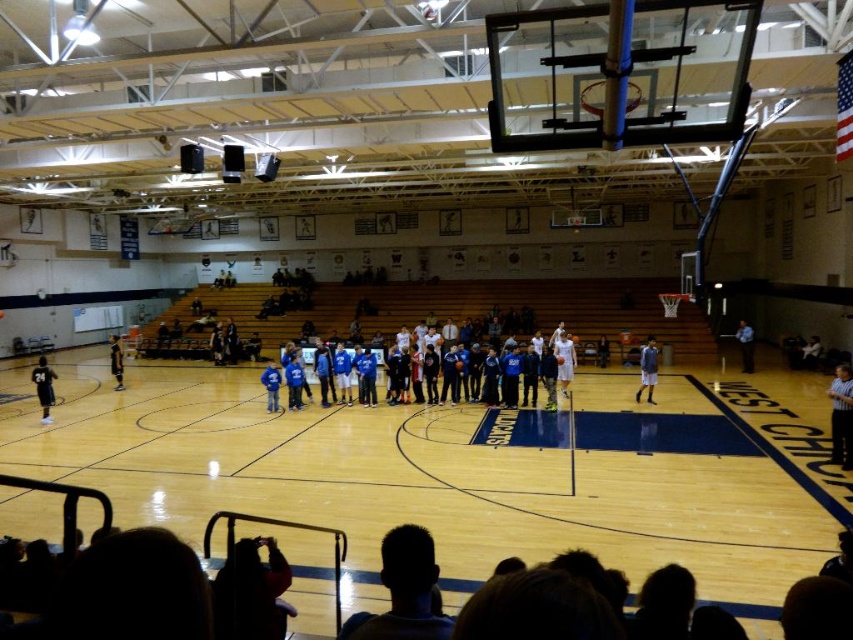
Looking at this image, is gray fabric jacket at lower right smaller than blue shirt at center?

Yes.

Is point (653, 371) positioned before point (741, 340)?

Yes, it is.

Is point (647, 348) in front of point (751, 365)?

That is True.

Image resolution: width=853 pixels, height=640 pixels. I want to click on gray fabric jacket at lower right, so click(x=647, y=369).

Is white matte basketball player at center below gray fabric jacket at lower right?

Yes, white matte basketball player at center is below gray fabric jacket at lower right.

The height and width of the screenshot is (640, 853). What do you see at coordinates (563, 358) in the screenshot?
I see `white matte basketball player at center` at bounding box center [563, 358].

Which is behind, point (556, 340) or point (645, 344)?

The point (645, 344) is more distant.

The height and width of the screenshot is (640, 853). Identify the location of white matte basketball player at center. (563, 358).

Who is positioned more to the left, gray fabric jacket at lower right or blue fleece jacket at center?

blue fleece jacket at center

Is point (650, 369) less distant than point (277, 404)?

That is False.

Which is in front, point (653, 371) or point (268, 388)?

Point (268, 388)

The image size is (853, 640). Identify the location of gray fabric jacket at lower right. (647, 369).